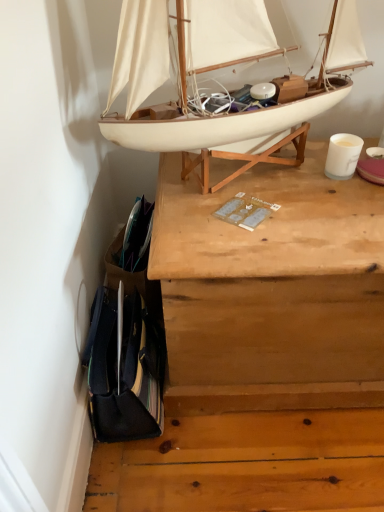
Locate an element on the screen. The image size is (384, 512). blank space above wooden chest at upper center (from a real-world perspective) is located at coordinates (299, 194).